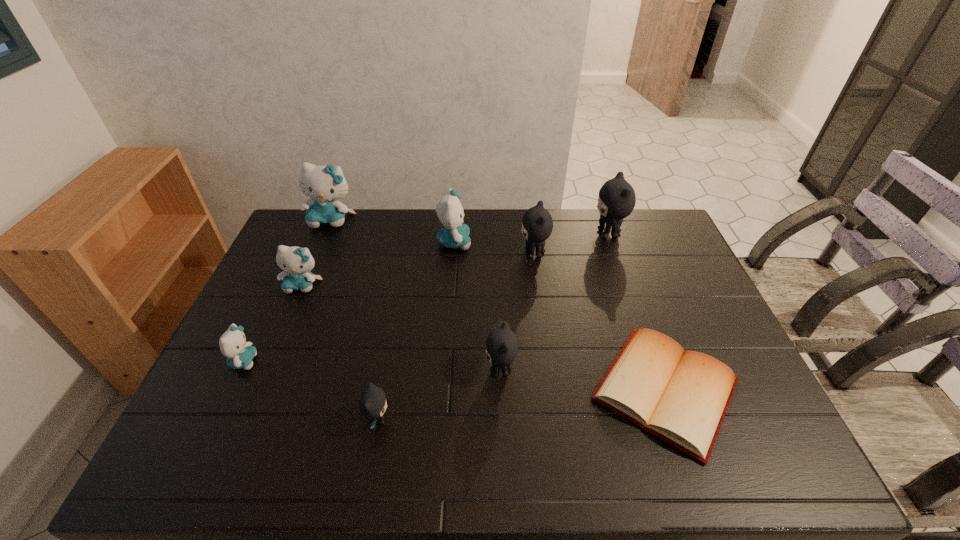
At what (x,y) coordinates should I click in order to perform the action: click on the sixth object from left to right. Please return your answer as a coordinate pair (x, y). The height and width of the screenshot is (540, 960). Looking at the image, I should click on (501, 345).

This screenshot has width=960, height=540. Identify the location of the nearest blue kitten. (233, 345).

You are a GUI agent. You are given a task and a screenshot of the screen. Output one action in this format:
    pyautogui.click(x=<x>, y=<y>)
    Task: Click on the leftmost gray kitten
    The height and width of the screenshot is (540, 960).
    Given the screenshot: What is the action you would take?
    pyautogui.click(x=372, y=404)

At what (x,y) coordinates should I click in order to perform the action: click on the fourth object from left to right. Please return your answer as a coordinate pair (x, y). The image size is (960, 540). Looking at the image, I should click on (372, 404).

Identify the location of the shortest object. (681, 397).

You are a GUI agent. You are given a task and a screenshot of the screen. Output one action in this format:
    pyautogui.click(x=<x>, y=<y>)
    Task: Click on the Bible
    
    Given the screenshot: What is the action you would take?
    pyautogui.click(x=681, y=397)

This screenshot has height=540, width=960. Find the location of `vacant area situated 0.270m on the face of the biggest blue kitten`. vacant area situated 0.270m on the face of the biggest blue kitten is located at coordinates (305, 283).

Locate an element on the screen. blank area located 0.370m on the front-facing side of the rightmost kitten is located at coordinates (489, 234).

I want to click on vacant area situated on the front-facing side of the rightmost kitten, so click(x=481, y=234).

The width and height of the screenshot is (960, 540). I want to click on free space located on the front-facing side of the rightmost kitten, so tap(572, 234).